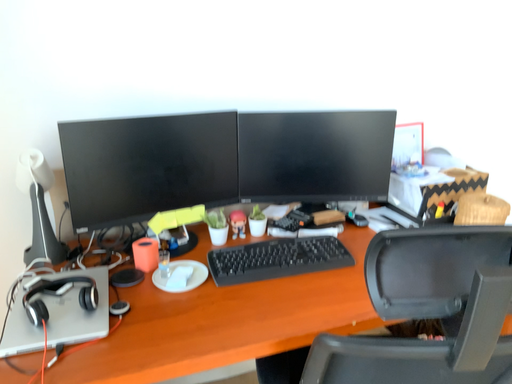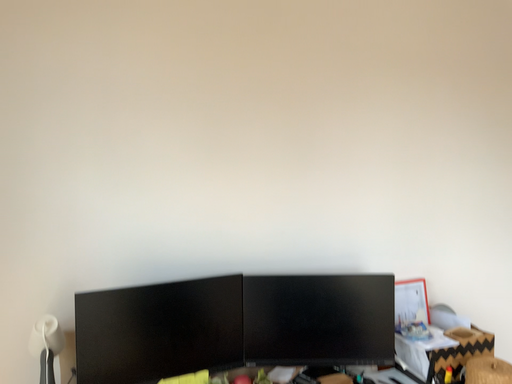
Question: Which way did the camera rotate in the video?

Choices:
 (A) rotated downward
 (B) rotated upward

Answer: (B)